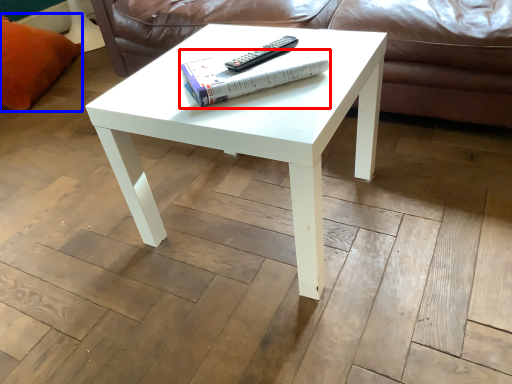
Question: Which of the following is the closest to the observer, paperback book (highlighted by a red box) or pillow (highlighted by a blue box)?

Choices:
 (A) paperback book
 (B) pillow

Answer: (A)